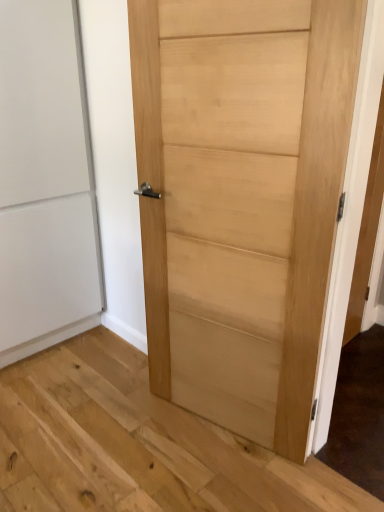
You are a GUI agent. You are given a task and a screenshot of the screen. Output one action in this format:
    pyautogui.click(x=<x>, y=<y>)
    Task: Click on the natural wood door at center
    
    Given the screenshot: What is the action you would take?
    pyautogui.click(x=241, y=199)

The image size is (384, 512). What do you see at coordinates (241, 199) in the screenshot?
I see `natural wood door at center` at bounding box center [241, 199].

You are a GUI agent. You are given a task and a screenshot of the screen. Output one action in this format:
    pyautogui.click(x=<x>, y=<y>)
    Task: Click on the natural wood door at center
    
    Given the screenshot: What is the action you would take?
    pyautogui.click(x=241, y=199)